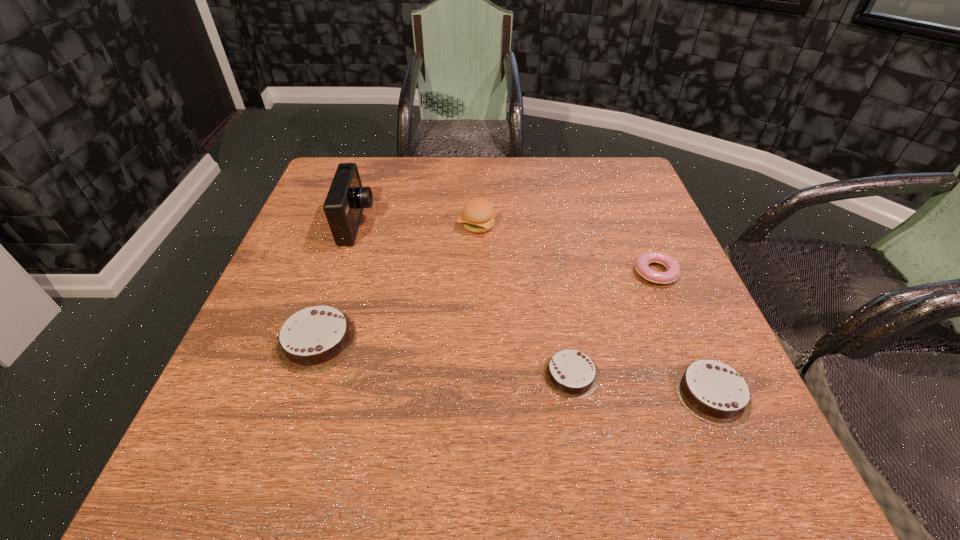
Locate an element on the screen. the second closest chocolate cake relative to the camera is located at coordinates (570, 373).

Locate an element on the screen. free space that satisfies the following two spatial constraints: 1. on the front-facing side of the rightmost chocolate cake; 2. on the left side of the camera is located at coordinates (301, 393).

Image resolution: width=960 pixels, height=540 pixels. Find the location of `vacant position in the image that satisfies the following two spatial constraints: 1. on the front-facing side of the fourth nearest object; 2. on the right side of the camera`. vacant position in the image that satisfies the following two spatial constraints: 1. on the front-facing side of the fourth nearest object; 2. on the right side of the camera is located at coordinates (341, 273).

At what (x,y) coordinates should I click in order to perform the action: click on free space in the image that satisfies the following two spatial constraints: 1. on the front side of the shortest chocolate cake; 2. on the left side of the fourth object from right to left. Please return your answer as a coordinate pair (x, y). The image size is (960, 540). Looking at the image, I should click on (477, 374).